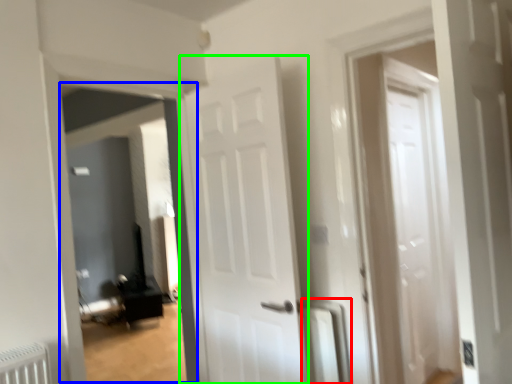
Question: Which object is the farthest from radiator (highlighted by a red box)? Choose among these: corridor (highlighted by a blue box) or door (highlighted by a green box).

Choices:
 (A) corridor
 (B) door

Answer: (A)